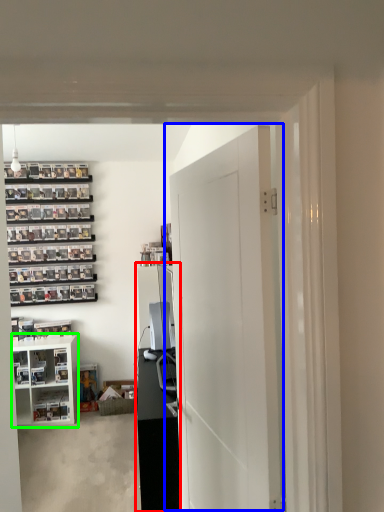
Question: Which object is positioned closest to entertainment center (highlighted by a red box)? Select from door (highlighted by a blue box) and cabinetry (highlighted by a green box).

Choices:
 (A) door
 (B) cabinetry

Answer: (A)